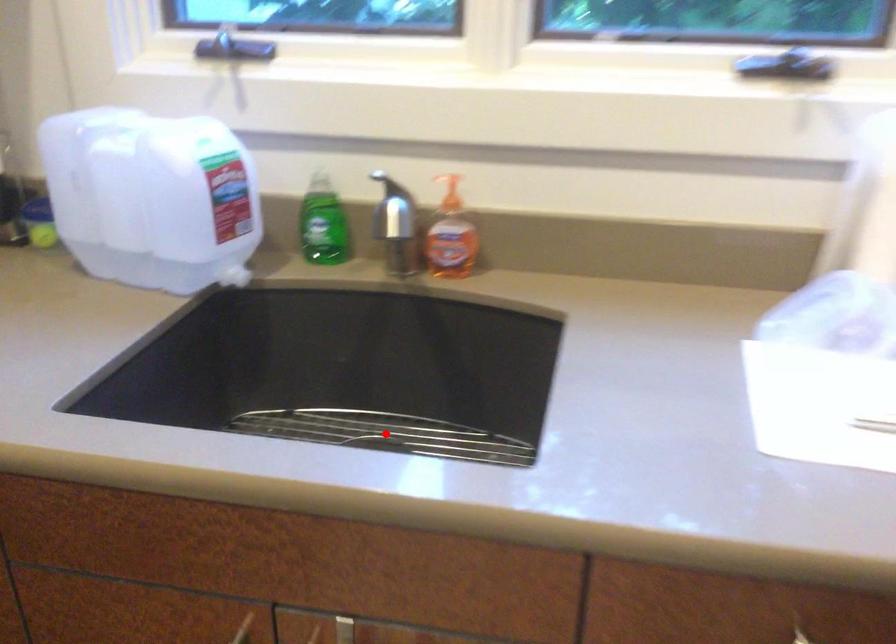
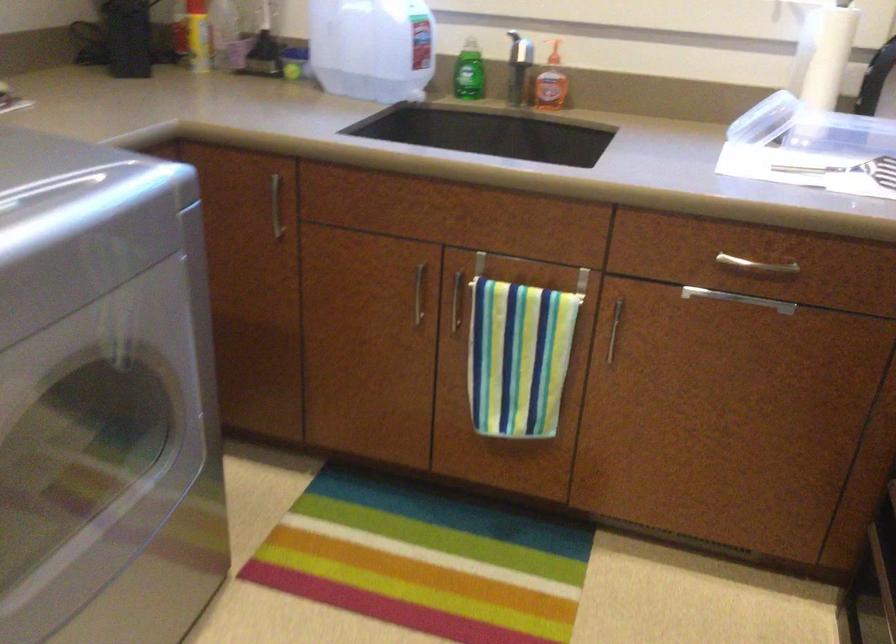
Question: I am providing you with two images of the same scene from different viewpoints. A red point is marked on the first image. Can you still see the location of the red point in image 2?

Choices:
 (A) Yes
 (B) No

Answer: (B)